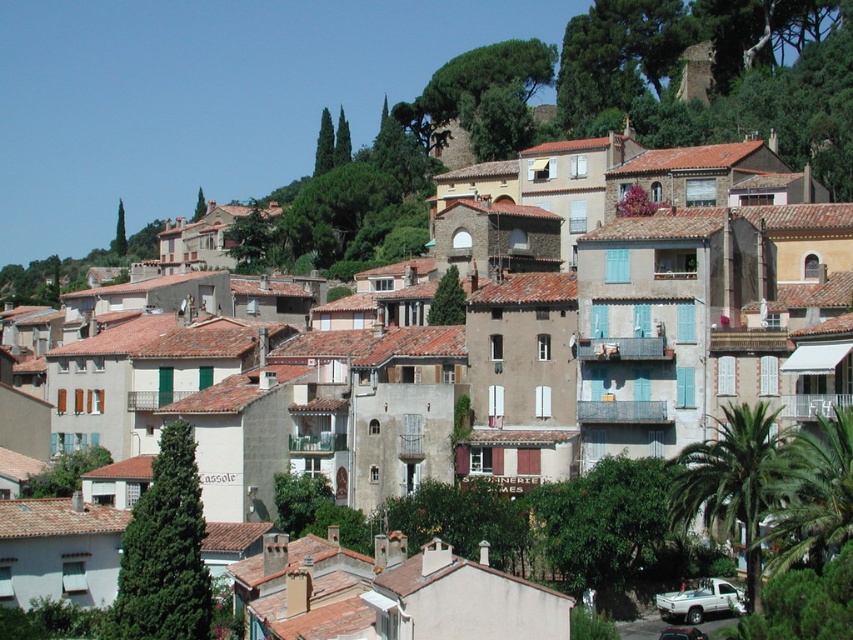
You are a tourist driving a car and want to park near the white matte truck at lower right and the metallic silver car at lower center. Which vehicle should you park behind to stay closer to the front of the scene?

You should park behind the metallic silver car at lower center because the white matte truck at lower right is further away from the front, making the metallic silver car at lower center closer to the front of the scene.

You are a tourist standing at the bottom of the hillside town and want to take a photo of both the white matte truck at lower right and the metallic silver car at lower center. Which vehicle should you position yourself closer to in order to capture both in the same frame?

The white matte truck at lower right is located above the metallic silver car at lower center, so you should position yourself closer to the metallic silver car at lower center to ensure both vehicles are visible in the frame.

You are a delivery driver who needs to park your vehicle in a tight space near the white matte truck at lower right and the metallic silver car at lower center. Which vehicle should you avoid parking next to to ensure enough space?

You should avoid parking next to the metallic silver car at lower center because the white matte truck at lower right is smaller, leaving more space available next to it.